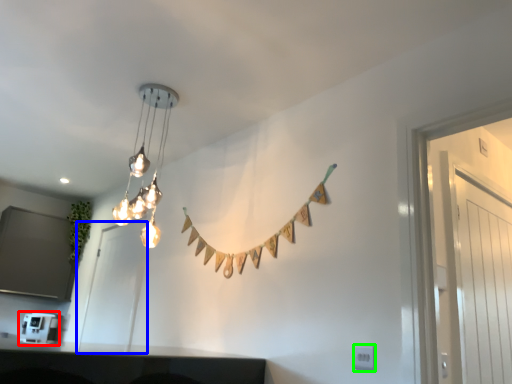
Question: Which object is the farthest from appliance (highlighted by a red box)? Choose among these: glass door (highlighted by a blue box) or electric outlet (highlighted by a green box).

Choices:
 (A) glass door
 (B) electric outlet

Answer: (B)